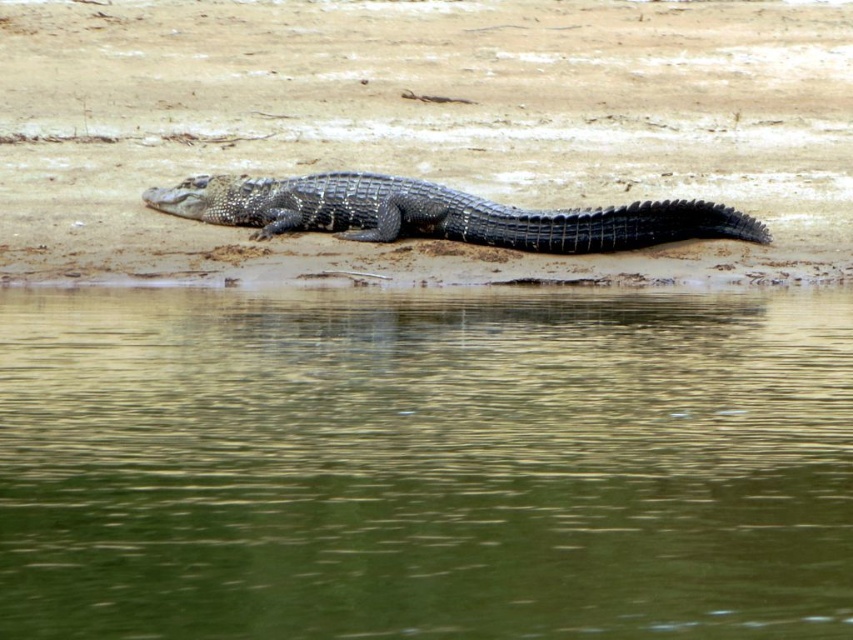
You are standing on the riverbank and see the green smooth water at lower center and the shiny black crocodile at center. Which object is located to the right of the other?

The green smooth water at lower center is positioned on the right side of shiny black crocodile at center.

You are standing at the origin point of the coordinate system in the image. You want to reach the green smooth water at lower center. What are the coordinates you need to move towards?

The coordinates you need to move towards are approximately 0.727 in the x direction and 0.498 in the y direction to reach the green smooth water at lower center.